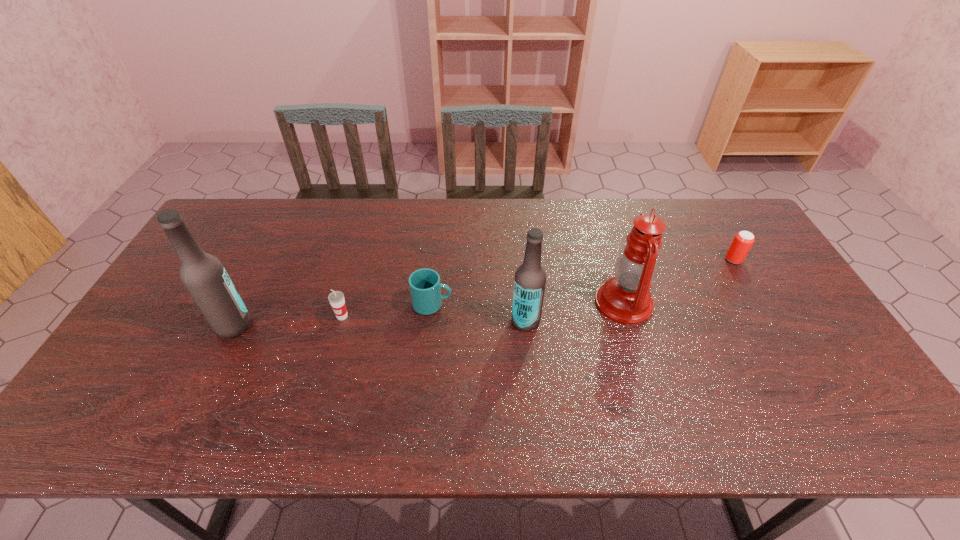
At what (x,y) coordinates should I click in order to perform the action: click on vacant space at the right edge of the desktop. Please return your answer as a coordinate pair (x, y). The image size is (960, 540). Looking at the image, I should click on (756, 277).

The width and height of the screenshot is (960, 540). I want to click on vacant space at the far left corner, so click(x=205, y=239).

In order to click on vacant region at the far right corner of the desktop in this screenshot , I will do `click(696, 212)`.

Identify the location of vacant space that is in between the left cup and the right cup. (387, 310).

The height and width of the screenshot is (540, 960). I want to click on vacant area between the shorter beer bottle and the left beer bottle, so click(x=380, y=323).

At what (x,y) coordinates should I click in order to perform the action: click on free space between the fifth object from right to left and the fourth object from left to right. Please return your answer as a coordinate pair (x, y). This screenshot has width=960, height=540. Looking at the image, I should click on (434, 319).

At what (x,y) coordinates should I click in order to perform the action: click on free spot between the right beer bottle and the leftmost object. Please return your answer as a coordinate pair (x, y). Looking at the image, I should click on (380, 323).

This screenshot has width=960, height=540. I want to click on vacant space that is in between the right cup and the taller beer bottle, so click(333, 315).

The height and width of the screenshot is (540, 960). I want to click on blank region between the second object from right to left and the rightmost object, so click(x=679, y=281).

Identify the location of free space between the right cup and the rightmost object. (x=583, y=282).